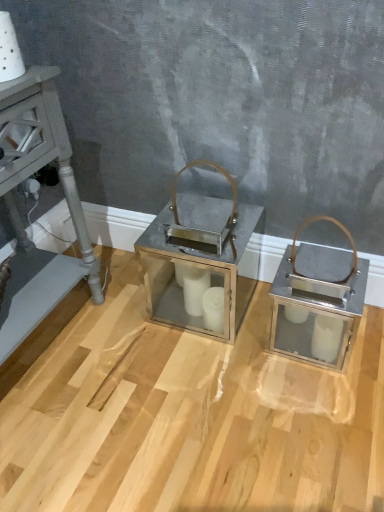
Where is `free space in front of metallic gray side table at left`? free space in front of metallic gray side table at left is located at coordinates (62, 443).